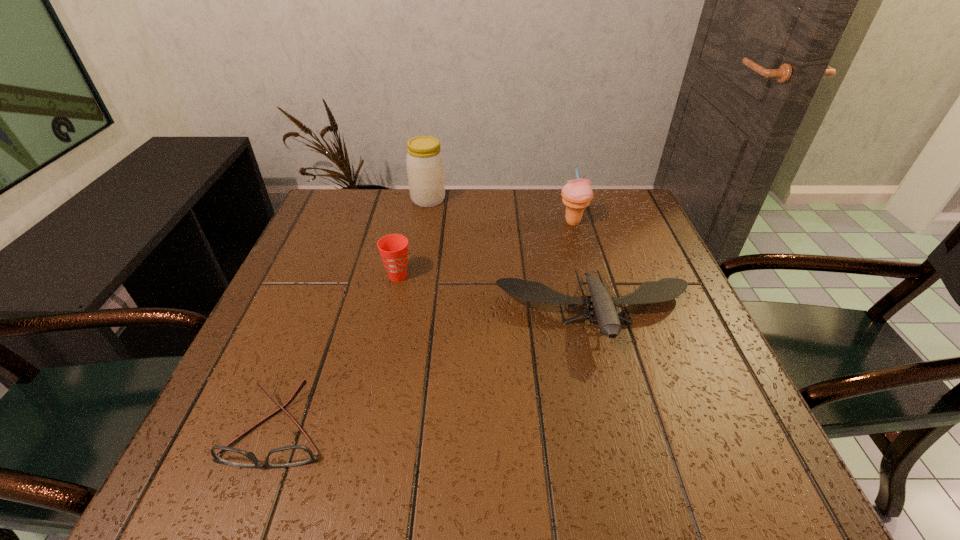
Where is `the farthest object`? the farthest object is located at coordinates (425, 166).

Identify the location of the fourth nearest object. The width and height of the screenshot is (960, 540). (577, 194).

Locate an element on the screen. the second tallest object is located at coordinates (577, 194).

Find the location of a particular element. Image resolution: width=960 pixels, height=540 pixels. the third shortest object is located at coordinates (393, 248).

The image size is (960, 540). I want to click on the fourth tallest object, so click(665, 289).

The width and height of the screenshot is (960, 540). I want to click on the nearest object, so click(295, 455).

Locate an element on the screen. spectacles is located at coordinates (295, 455).

You are a GUI agent. You are given a task and a screenshot of the screen. Output one action in this format:
    pyautogui.click(x=<x>, y=<y>)
    Task: Click on the vacant space located 0.110m on the left of the farthest object
    
    Given the screenshot: What is the action you would take?
    pyautogui.click(x=373, y=199)

Where is `vacant space located on the left of the fourth nearest object`? The height and width of the screenshot is (540, 960). vacant space located on the left of the fourth nearest object is located at coordinates (420, 222).

Where is `vacant space located 0.130m on the right of the cup`? The image size is (960, 540). vacant space located 0.130m on the right of the cup is located at coordinates (468, 276).